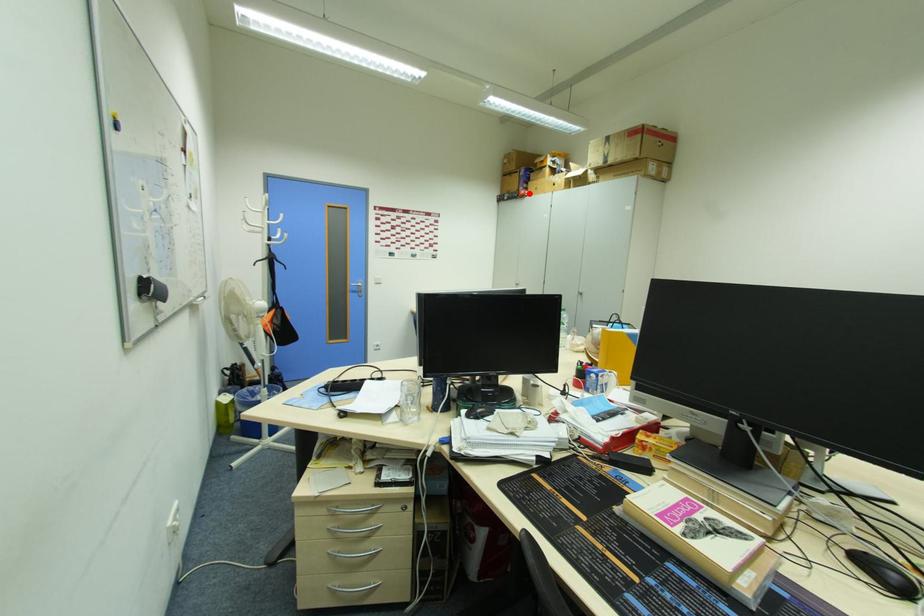
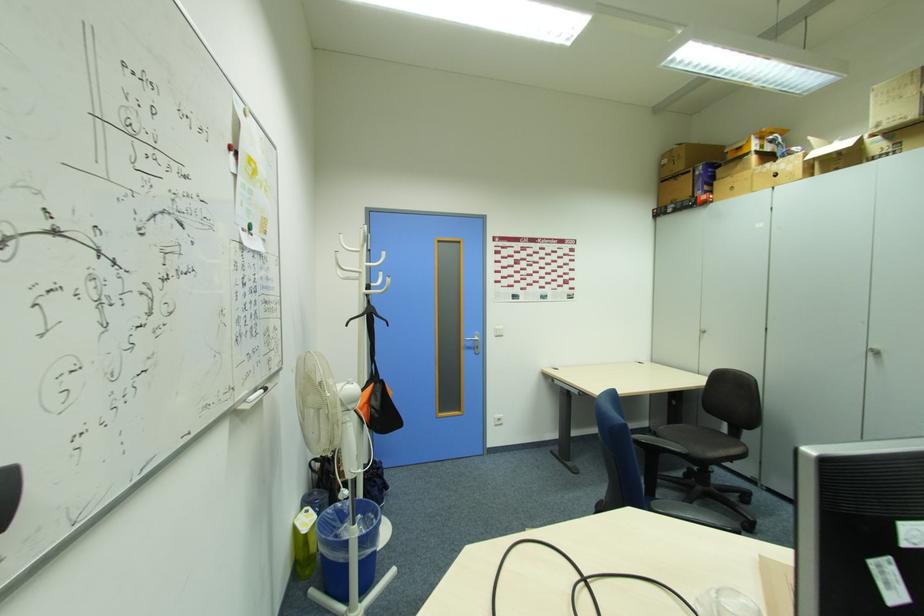
Question: I am providing you with two images of the same scene from different viewpoints. A red point is marked on the first image. Is the red point's position out of view in image 2?

Choices:
 (A) Yes
 (B) No

Answer: (B)